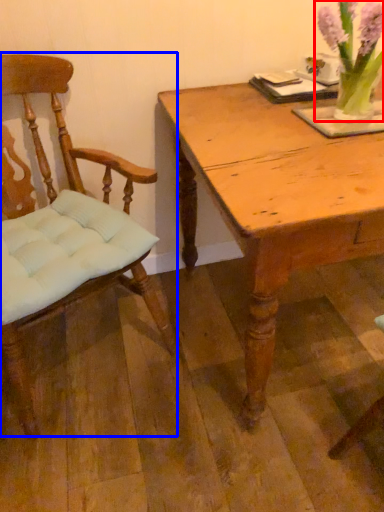
Question: Which of the following is the closest to the observer, floral arrangement (highlighted by a red box) or chair (highlighted by a blue box)?

Choices:
 (A) floral arrangement
 (B) chair

Answer: (B)